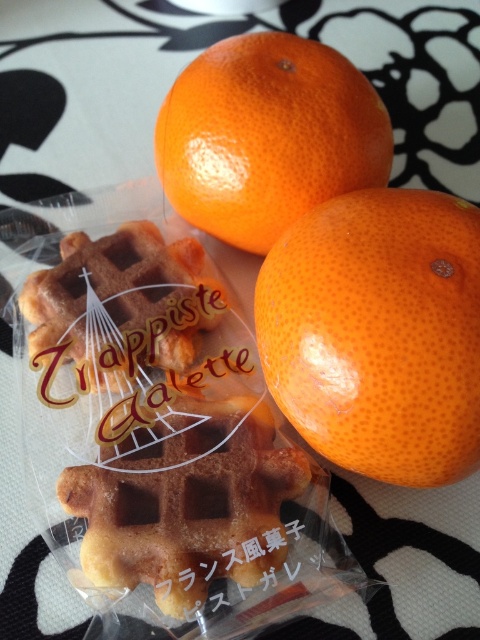
You are standing in a kitchen and see the glossy orange at upper center. If you want to reach it without moving your feet, can you do so?

The glossy orange at upper center is 1.30 meters away from you, which is beyond typical arm reach. You cannot reach it without moving your feet.

You are arranging items on a table and need to place the glossy orange at upper center and the golden brown waffle at center. Based on their positions, which item is closer to you?

The glossy orange at upper center is closer to you because it is in front of the golden brown waffle at center.